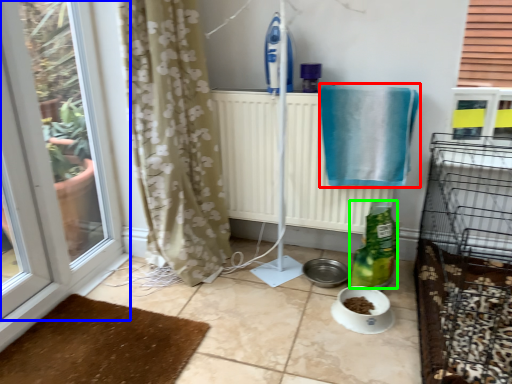
Question: Which object is the closest to the bath towel (highlighted by a red box)? Choose among these: window (highlighted by a blue box) or bottle (highlighted by a green box).

Choices:
 (A) window
 (B) bottle

Answer: (B)